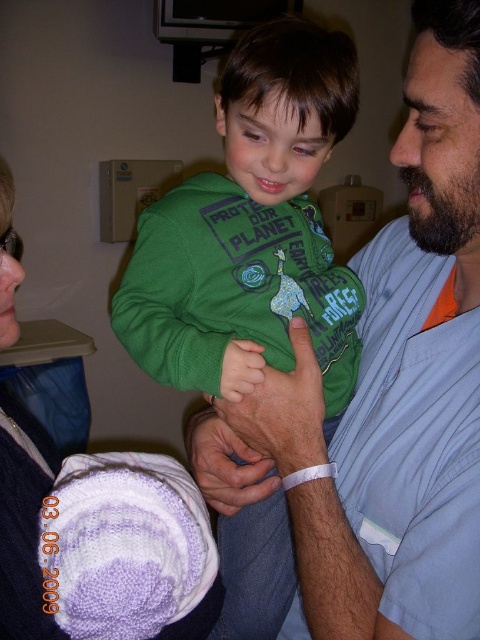
From the picture: Does blue cotton shirt at center have a lesser width compared to green cotton hoodie at center?

Correct, blue cotton shirt at center's width is less than green cotton hoodie at center's.

Can you confirm if blue cotton shirt at center is shorter than green cotton hoodie at center?

Yes.

Between point (305, 340) and point (315, 243), which one is positioned in front?

Point (305, 340) is more forward.

Locate an element on the screen. The width and height of the screenshot is (480, 640). blue cotton shirt at center is located at coordinates (386, 392).

Can you confirm if blue cotton shirt at center is taller than knitted purple sweater at lower left?

Yes.

Can you confirm if blue cotton shirt at center is wider than knitted purple sweater at lower left?

No, blue cotton shirt at center is not wider than knitted purple sweater at lower left.

Image resolution: width=480 pixels, height=640 pixels. What do you see at coordinates (386, 392) in the screenshot?
I see `blue cotton shirt at center` at bounding box center [386, 392].

Where is `blue cotton shirt at center`? Image resolution: width=480 pixels, height=640 pixels. blue cotton shirt at center is located at coordinates (386, 392).

Which of these two, green cotton hoodie at center or knitted purple sweater at lower left, stands shorter?

knitted purple sweater at lower left

Is green cotton hoodie at center to the left of knitted purple sweater at lower left from the viewer's perspective?

No, green cotton hoodie at center is not to the left of knitted purple sweater at lower left.

This screenshot has width=480, height=640. Identify the location of green cotton hoodie at center. (252, 230).